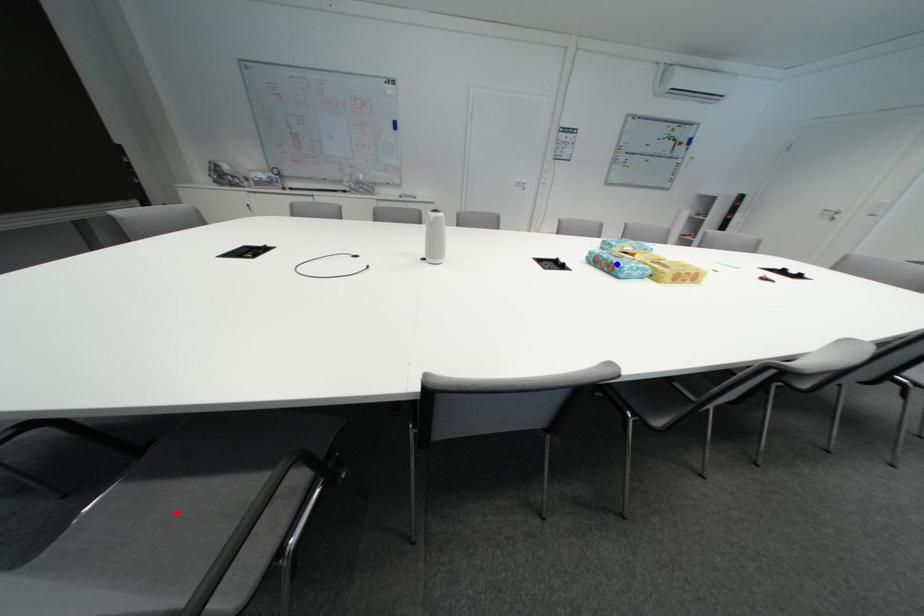
Question: Which of the two points in the image is closer to the camera?

Choices:
 (A) Blue point is closer.
 (B) Red point is closer.

Answer: (B)